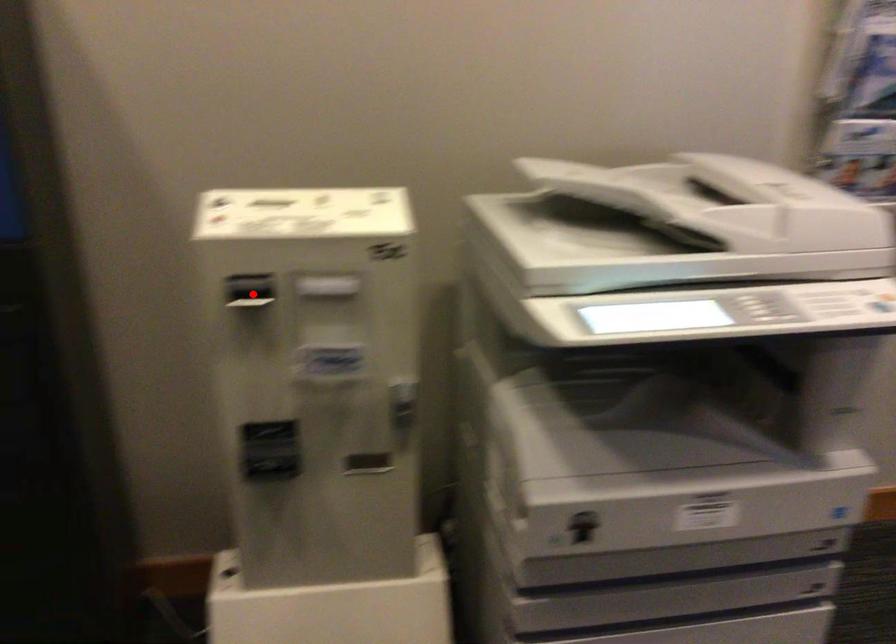
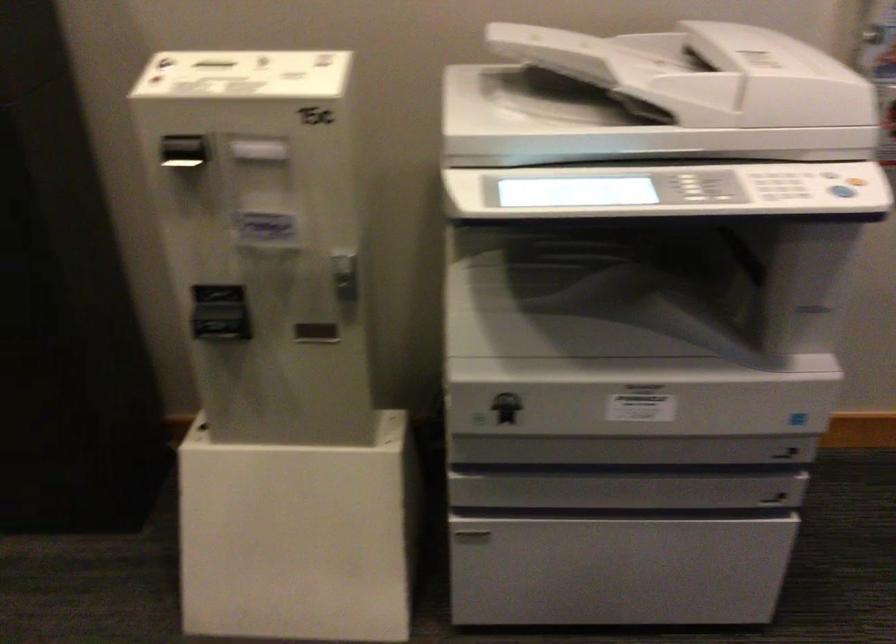
Find the pixel in the second image that matches the highlighted location in the first image.

(185, 156)